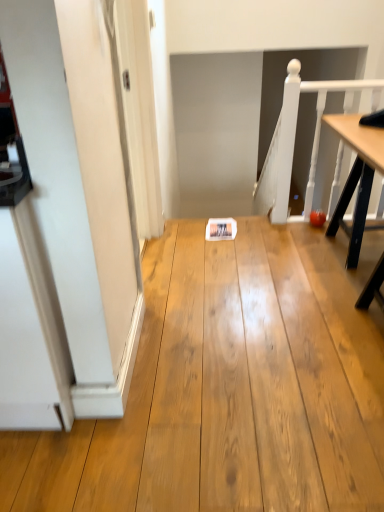
Image resolution: width=384 pixels, height=512 pixels. Describe the element at coordinates (294, 141) in the screenshot. I see `white wooden rail at upper right` at that location.

Locate an element on the screen. The image size is (384, 512). white wooden rail at upper right is located at coordinates (294, 141).

Identify the location of white wooden rail at upper right. (294, 141).